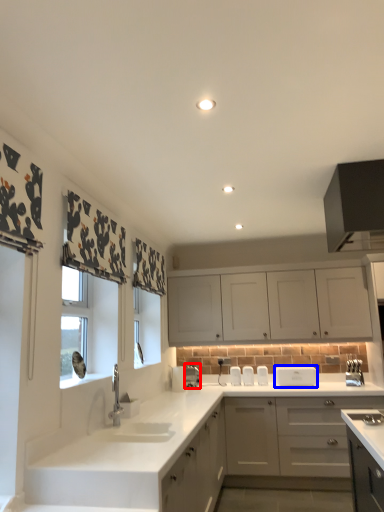
Question: Which object is closer to the camera taking this photo, appliance (highlighted by a red box) or appliance (highlighted by a blue box)?

Choices:
 (A) appliance
 (B) appliance

Answer: (B)